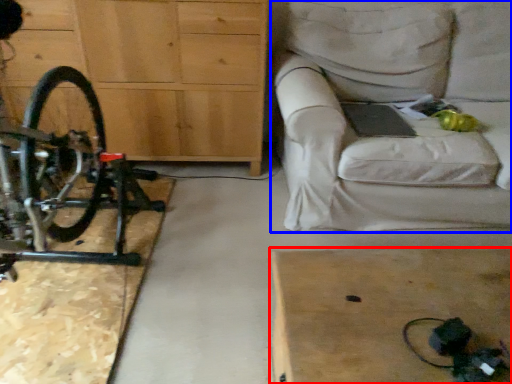
Question: Which object is further to the camera taking this photo, table (highlighted by a red box) or studio couch (highlighted by a blue box)?

Choices:
 (A) table
 (B) studio couch

Answer: (B)